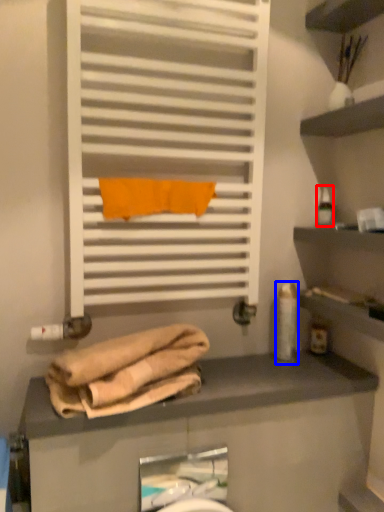
Question: Which object is further to the camera taking this photo, toiletry (highlighted by a red box) or toiletry (highlighted by a blue box)?

Choices:
 (A) toiletry
 (B) toiletry

Answer: (A)